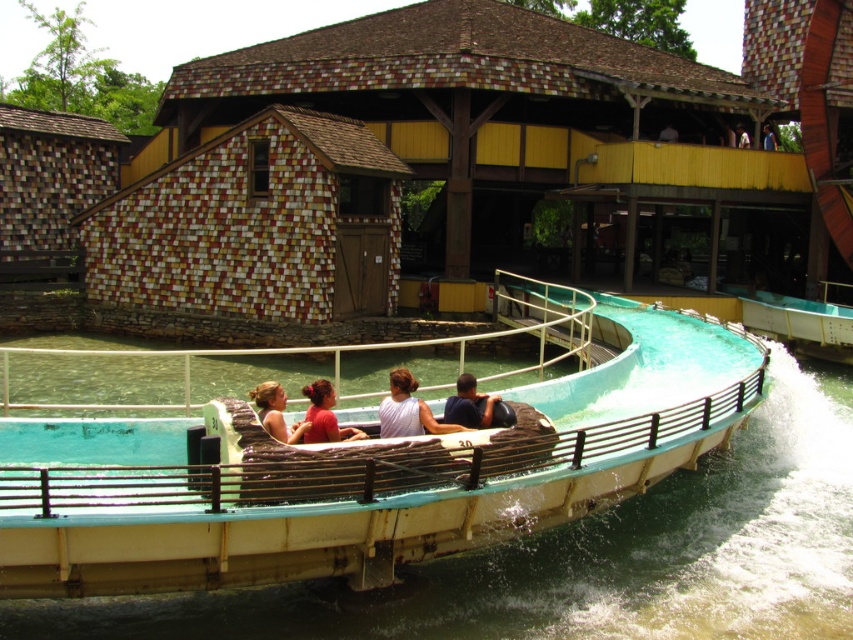
Is matte white tank top at center closer to the viewer compared to dark blue fabric at center?

That is True.

I want to click on matte white tank top at center, so [x=408, y=410].

Between teal rubber boat at center and dark blue fabric at center, which one is positioned lower?

Positioned lower is dark blue fabric at center.

Who is more forward, (703,344) or (471,381)?

Point (471,381) is in front.

Locate an element on the screen. teal rubber boat at center is located at coordinates (367, 467).

Can you confirm if matte white tank top at center is shorter than white fabric person at upper center?

In fact, matte white tank top at center may be taller than white fabric person at upper center.

Is matte white tank top at center wider than white fabric person at upper center?

No, matte white tank top at center is not wider than white fabric person at upper center.

Which is behind, point (399, 404) or point (737, 138)?

Positioned behind is point (737, 138).

Find the location of a particular element. The width and height of the screenshot is (853, 640). matte white tank top at center is located at coordinates (408, 410).